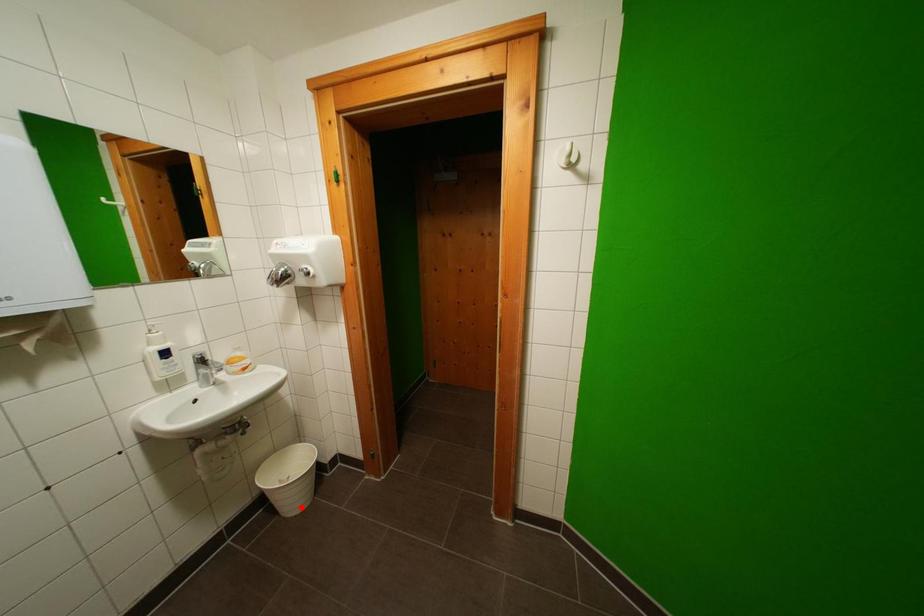
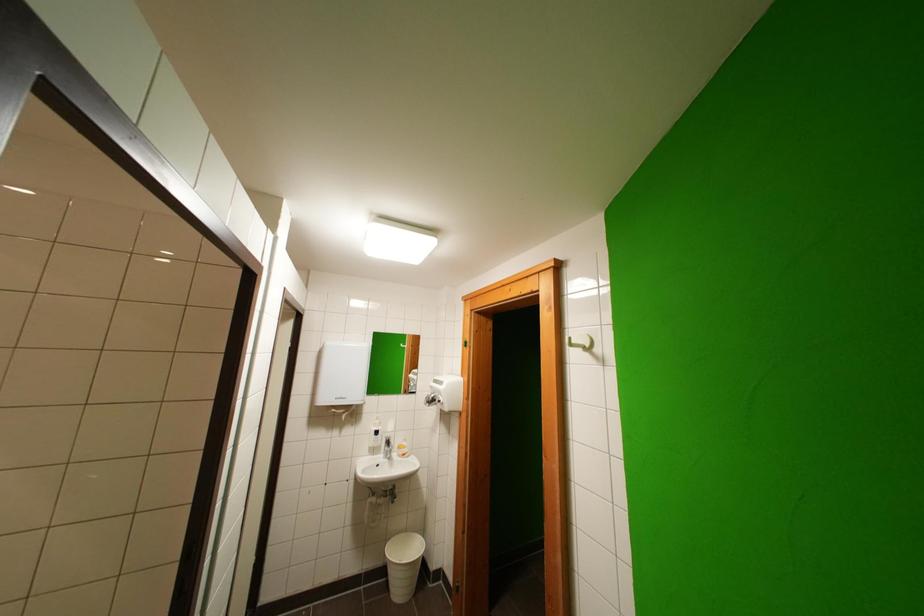
Question: I am providing you with two images of the same scene from different viewpoints. Given a red point in image1, look at the same physical point in image2. Is it:

Choices:
 (A) Closer to the viewpoint
 (B) Farther from the viewpoint

Answer: (B)